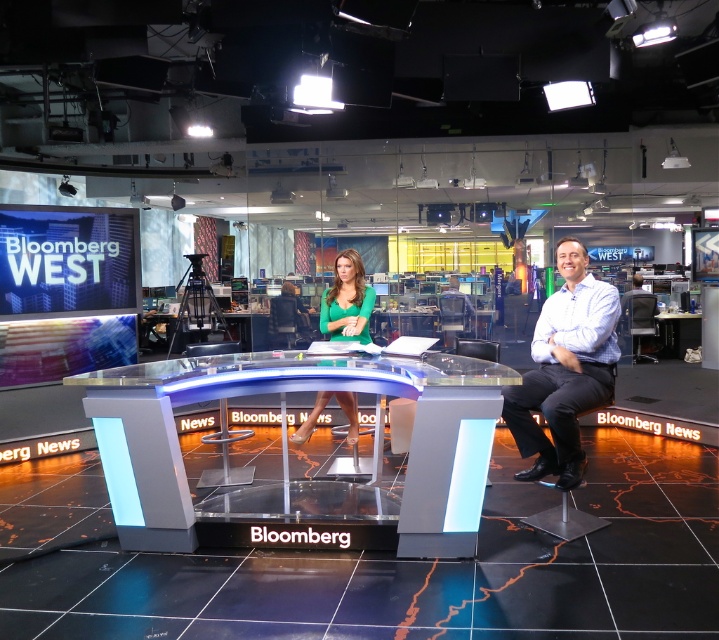
Question: Is green matte dress at center wider than gray fabric chair at right?

Choices:
 (A) no
 (B) yes

Answer: (A)

Question: Which object is positioned closest to the white shirt at right?

Choices:
 (A) green matte dress at center
 (B) gray fabric chair at right

Answer: (A)

Question: Considering the real-world distances, which object is closest to the white shirt at right?

Choices:
 (A) gray fabric chair at right
 (B) green matte dress at center

Answer: (B)

Question: Observing the image, what is the correct spatial positioning of white shirt at right in reference to gray fabric chair at right?

Choices:
 (A) below
 (B) above

Answer: (A)

Question: Is white shirt at right above gray fabric chair at right?

Choices:
 (A) no
 (B) yes

Answer: (A)

Question: Considering the real-world distances, which object is farthest from the white shirt at right?

Choices:
 (A) green matte dress at center
 (B) gray fabric chair at right

Answer: (B)